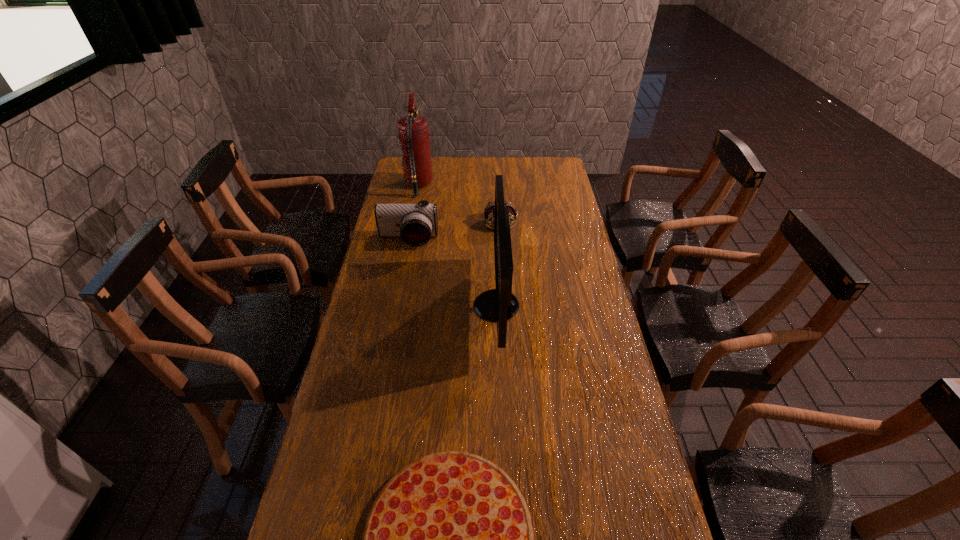
Identify the location of object situated at the far edge. This screenshot has height=540, width=960. (413, 130).

This screenshot has width=960, height=540. Find the location of `fire extinguisher present at the left edge`. fire extinguisher present at the left edge is located at coordinates pyautogui.click(x=413, y=130).

The height and width of the screenshot is (540, 960). Find the location of `camcorder positioned at the left edge`. camcorder positioned at the left edge is located at coordinates (415, 223).

Locate an element on the screen. The width and height of the screenshot is (960, 540). object that is at the far left corner is located at coordinates point(413,130).

You are a GUI agent. You are given a task and a screenshot of the screen. Output one action in this format:
    pyautogui.click(x=<x>, y=<y>)
    Task: Click on the vacant space at the far edge of the desktop
    This screenshot has width=960, height=540.
    Given the screenshot: What is the action you would take?
    pyautogui.click(x=517, y=175)

Identify the location of free space at the left edge of the desktop. (406, 198).

I want to click on vacant space at the right edge of the desktop, so click(x=556, y=206).

Find the location of `free space at the far right corner`. free space at the far right corner is located at coordinates (550, 157).

Locate an element on the screen. free point between the third shortest object and the computer monitor is located at coordinates (452, 273).

The height and width of the screenshot is (540, 960). In order to click on empty space between the crown and the camcorder in this screenshot , I will do `click(454, 231)`.